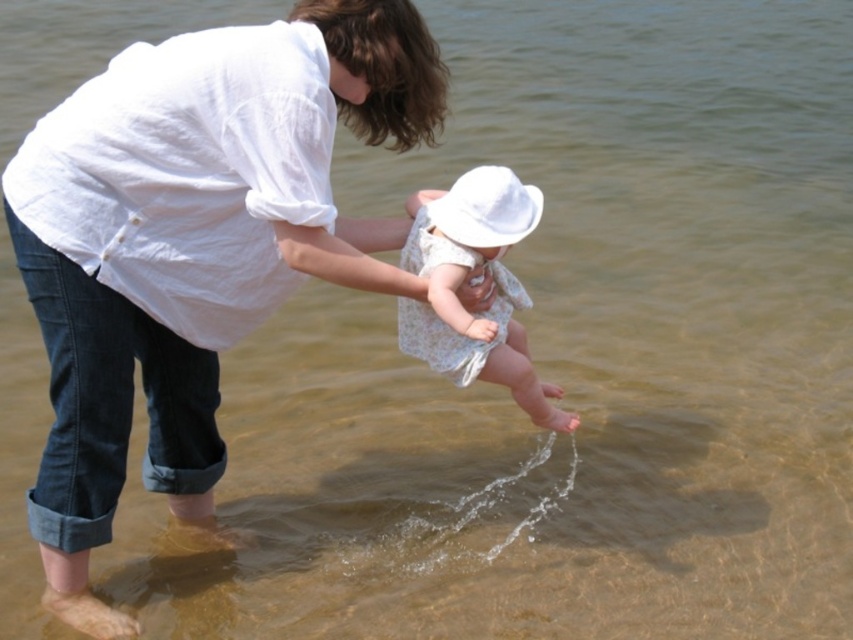
You are a photographer trying to capture the child in the scene. The child is wearing a white lace dress at center and a white matte hat at center. To ensure both items are visible in the frame, which item should you focus on to avoid cropping either?

The white lace dress at center is wider than the white matte hat at center, so you should focus on the white lace dress at center to ensure both items fit within the frame without cropping.

You are a photographer trying to capture the child in the scene. The child is wearing a white lace dress at center and a white matte hat at center. Which clothing item is positioned closer to the camera?

The white lace dress at center is closer to the viewer than the white matte hat at center, so the photographer would see the white lace dress at center first when focusing on the child.

You are a photographer trying to capture the perfect shot of the white lace dress at center. Where should you position your camera to ensure the dress is centered in the frame?

To center the white lace dress at center in the frame, position the camera at point coordinates approximately 0.434 on the x axis and 0.543 on the y axis.